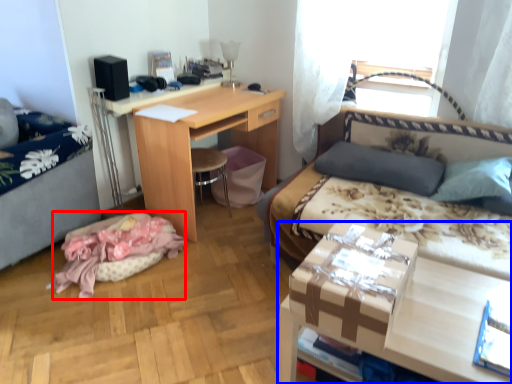
Question: Which object appears farthest to the camera in this image, material (highlighted by a red box) or desk (highlighted by a blue box)?

Choices:
 (A) material
 (B) desk

Answer: (A)